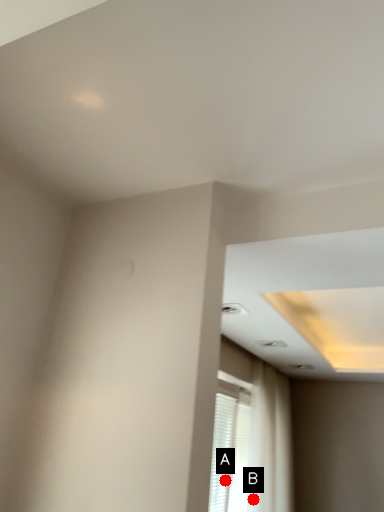
Question: Two points are circled on the image, labeled by A and B beside each circle. Which point is closer to the camera?

Choices:
 (A) A is closer
 (B) B is closer

Answer: (A)